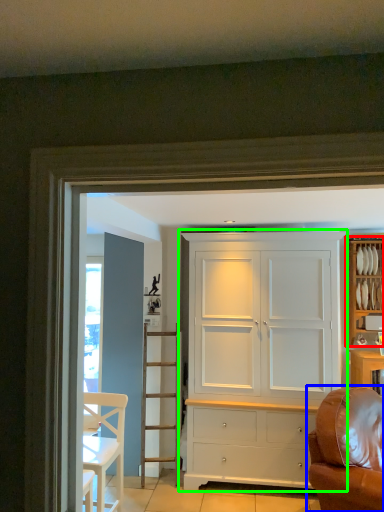
Question: Which object is positioned closest to cabinetry (highlighted by a red box)? Select from studio couch (highlighted by a blue box) and cupboard (highlighted by a green box).

Choices:
 (A) studio couch
 (B) cupboard

Answer: (B)